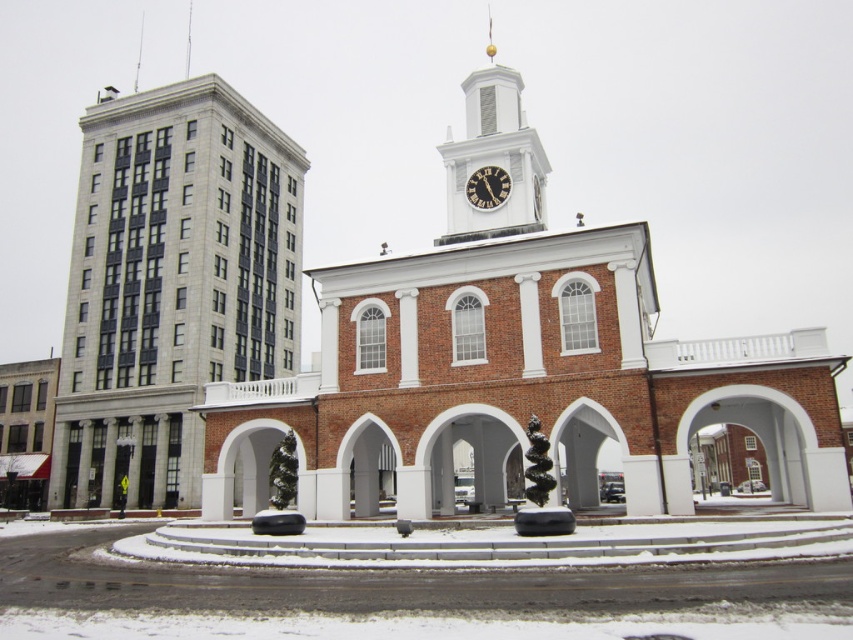
Question: Which point appears closest to the camera in this image?

Choices:
 (A) (654, 369)
 (B) (508, 234)

Answer: (A)

Question: Is brick building at center positioned at the back of black glossy clock at center?

Choices:
 (A) yes
 (B) no

Answer: (B)

Question: Can you confirm if brick building at center is positioned to the left of white painted wood clock tower at upper center?

Choices:
 (A) yes
 (B) no

Answer: (B)

Question: Among these objects, which one is farthest from the camera?

Choices:
 (A) black glossy clock at center
 (B) brick building at center
 (C) gray stone building at left
 (D) white painted wood clock tower at upper center

Answer: (C)

Question: Can you confirm if gray stone building at left is wider than white painted wood clock tower at upper center?

Choices:
 (A) yes
 (B) no

Answer: (A)

Question: Which of the following is the closest to the observer?

Choices:
 (A) (173, 408)
 (B) (495, 208)
 (C) (480, 193)

Answer: (B)